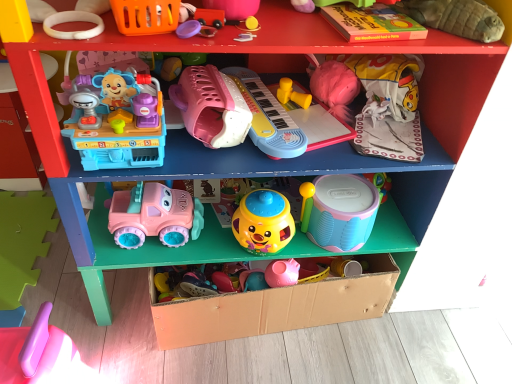
Question: From the image's perspective, is rubber duck at upper center, arranged as the tenth toy when viewed from the left, located above or below purple plastic lid at upper center, which is the ninth toy in right-to-left order?

Choices:
 (A) above
 (B) below

Answer: (A)

Question: Considering the positions of rubber duck at upper center, arranged as the tenth toy when viewed from the left, and purple plastic lid at upper center, which is the ninth toy in right-to-left order, in the image, is rubber duck at upper center, arranged as the tenth toy when viewed from the left, taller or shorter than purple plastic lid at upper center, which is the ninth toy in right-to-left order,?

Choices:
 (A) tall
 (B) short

Answer: (A)

Question: Estimate the real-world distances between objects in this image. Which object is closer to the matte pink plastic truck at lower center, the 11th toy in the right-to-left sequence?

Choices:
 (A) yellow matte plastic cup at center, which is the 8th toy in left-to-right order
 (B) pink plastic keyboard at center, the 6th toy from the right
 (C) pink plastic spatula at lower left, marked as the first toy in a left-to-right arrangement
 (D) pastel blue plastic drum at center, which is the eleventh toy from left to right
 (E) yellow plastic toy at upper center, marked as the 4th toy in a right-to-left arrangement

Answer: (A)

Question: Which of these objects is positioned farthest from the rubber duck at upper center, arranged as the tenth toy when viewed from the left?

Choices:
 (A) yellow rubber ball at upper center, which is the 7th toy in right-to-left order
 (B) matte pink plastic truck at lower center, the 11th toy in the right-to-left sequence
 (C) pink plastic spatula at lower left, the 12th toy when ordered from right to left
 (D) pink plastic keyboard at upper center, which appears as the 3th toy when viewed from the left
 (E) purple plastic lid at upper center, which is the ninth toy in right-to-left order

Answer: (C)